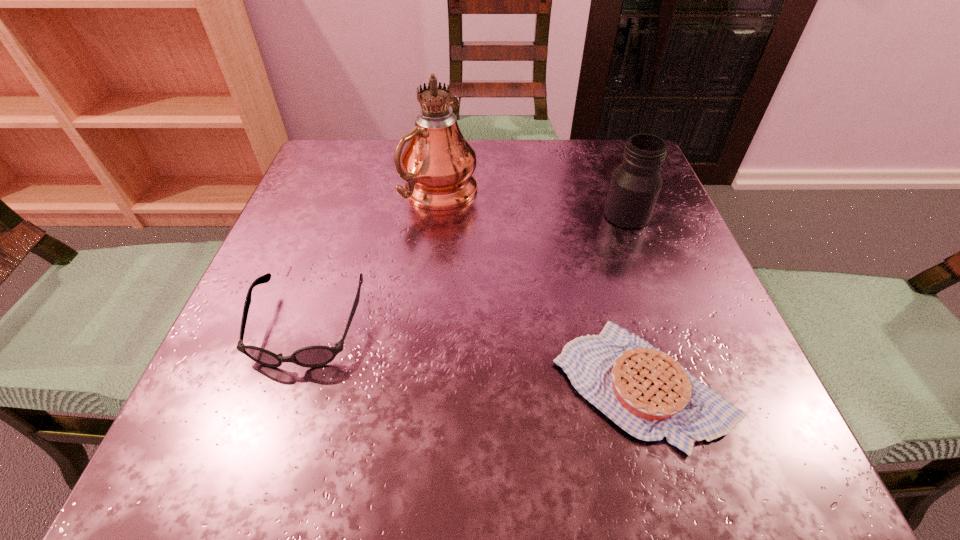
The image size is (960, 540). Identify the location of vacant space in between the third tallest object and the second object from left to right. [x=374, y=260].

Find the location of a particular element. The image size is (960, 540). vacant region between the pie and the tallest object is located at coordinates (541, 288).

Identify which object is the third nearest to the shortest object. Please provide its 2D coordinates. Your answer should be formatted as a tuple, i.e. [(x, y)], where the tuple contains the x and y coordinates of a point satisfying the conditions above.

[(312, 356)]

Point out which object is positioned as the third nearest to the jar. Please provide its 2D coordinates. Your answer should be formatted as a tuple, i.e. [(x, y)], where the tuple contains the x and y coordinates of a point satisfying the conditions above.

[(312, 356)]

Identify the location of vacant space that satisfies the following two spatial constraints: 1. on the lenses of the shortest object; 2. on the right side of the sunglasses. This screenshot has width=960, height=540. (288, 383).

Where is `vacant space that satisfies the following two spatial constraints: 1. on the lenses of the shortest object; 2. on the left side of the sunglasses`? The image size is (960, 540). vacant space that satisfies the following two spatial constraints: 1. on the lenses of the shortest object; 2. on the left side of the sunglasses is located at coordinates (288, 383).

The width and height of the screenshot is (960, 540). I want to click on free space that satisfies the following two spatial constraints: 1. on the lenses of the third tallest object; 2. on the right side of the shortest object, so click(288, 383).

Where is `vacant space that satisfies the following two spatial constraints: 1. on the front side of the oil lamp; 2. on the left side of the pie`? This screenshot has width=960, height=540. vacant space that satisfies the following two spatial constraints: 1. on the front side of the oil lamp; 2. on the left side of the pie is located at coordinates (420, 383).